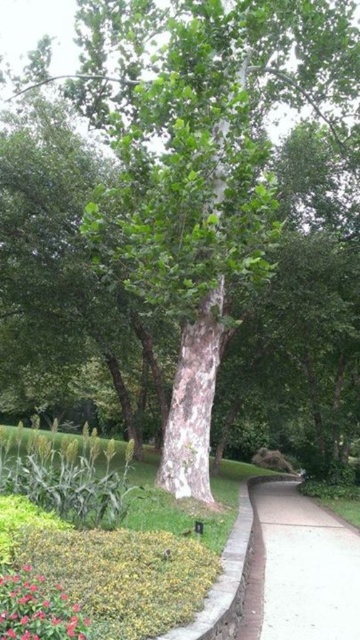
You are standing at the center of the park and see the white concrete sidewalk at lower right and the vivid pink petals at lower left. Which object is positioned to the right side of the other?

The white concrete sidewalk at lower right is to the right of the vivid pink petals at lower left.

You are standing at the center of the image and want to walk to the white concrete sidewalk at lower right. In which general direction should you move?

Since the white concrete sidewalk at lower right is located at point [306,566], you should move towards the lower right direction from the center to reach it.